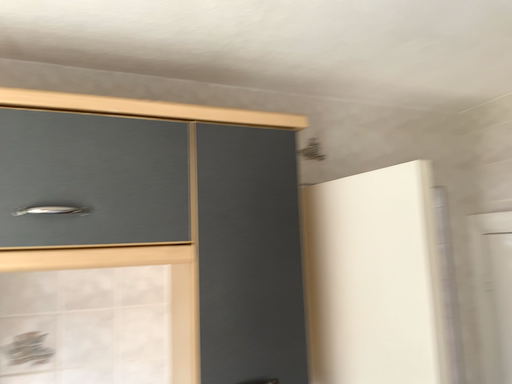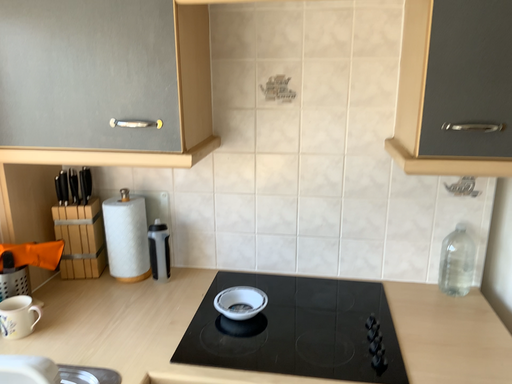
Question: Which way did the camera rotate in the video?

Choices:
 (A) rotated upward
 (B) rotated downward

Answer: (B)